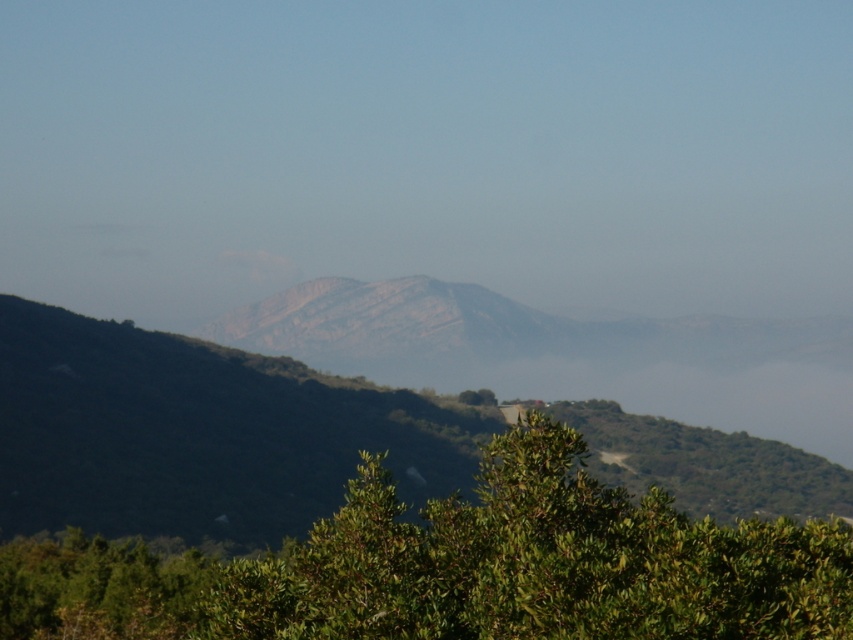
Question: Is green leafy tree at center to the right of rugged stone mountain at center from the viewer's perspective?

Choices:
 (A) yes
 (B) no

Answer: (B)

Question: Which of the following is the closest to the observer?

Choices:
 (A) rugged stone mountain at center
 (B) green leafy tree at center

Answer: (B)

Question: Which point is farther from the camera taking this photo?

Choices:
 (A) (802, 525)
 (B) (51, 314)

Answer: (B)

Question: Is green leafy tree at center behind rugged stone mountain at center?

Choices:
 (A) no
 (B) yes

Answer: (A)

Question: Is green leafy tree at center smaller than rugged stone mountain at center?

Choices:
 (A) yes
 (B) no

Answer: (A)